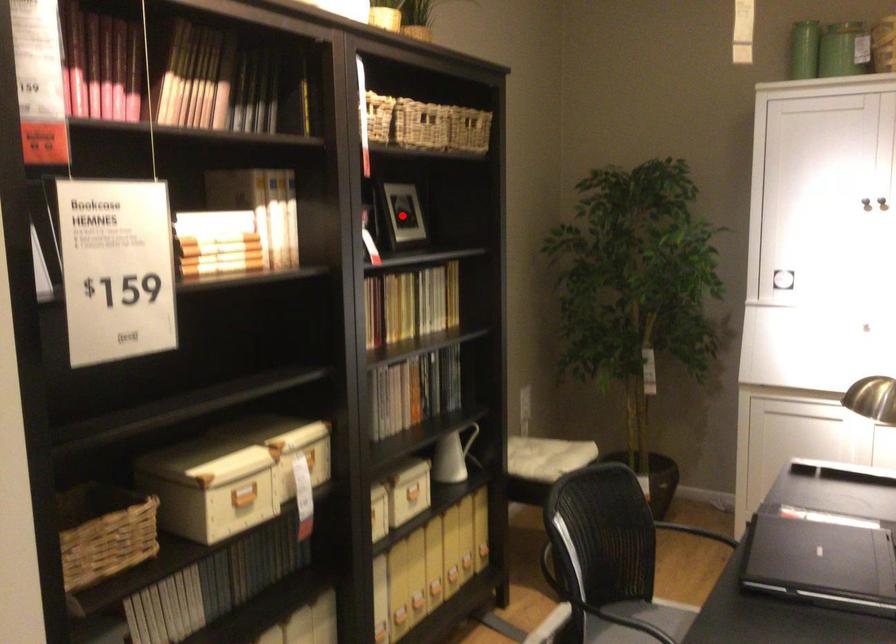
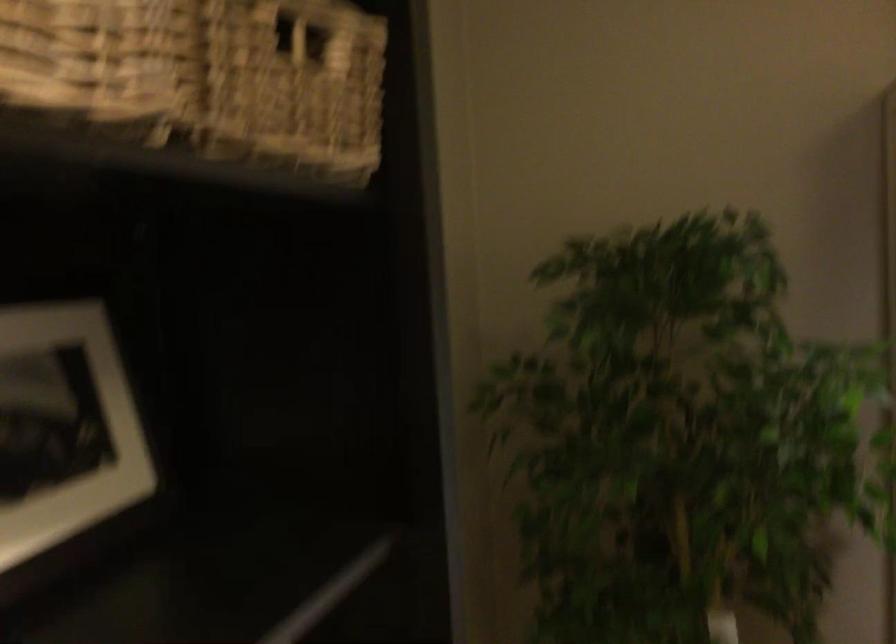
Question: I am providing you with two images of the same scene from different viewpoints. A red point is marked on the first image. At the location where the point appears in image 1, is it still visible in image 2?

Choices:
 (A) Yes
 (B) No

Answer: (A)